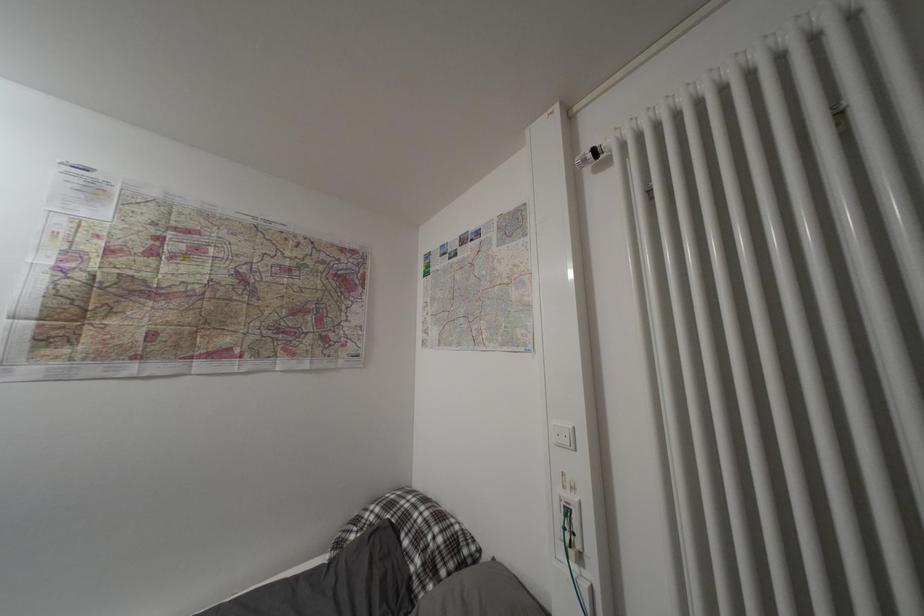
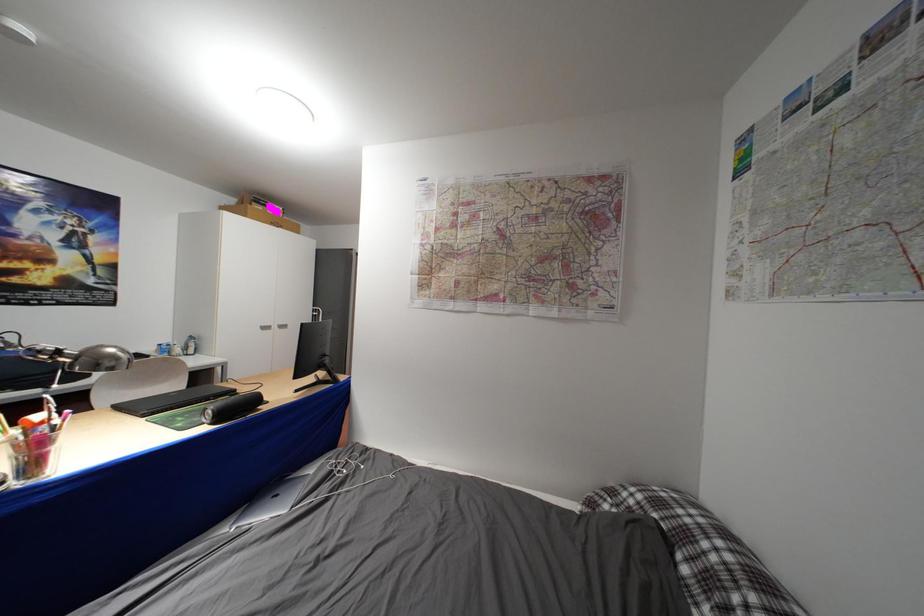
Question: The images are taken continuously from a first-person perspective. In which direction is your viewpoint rotating?

Choices:
 (A) Left
 (B) Right
 (C) Up
 (D) Down

Answer: (A)